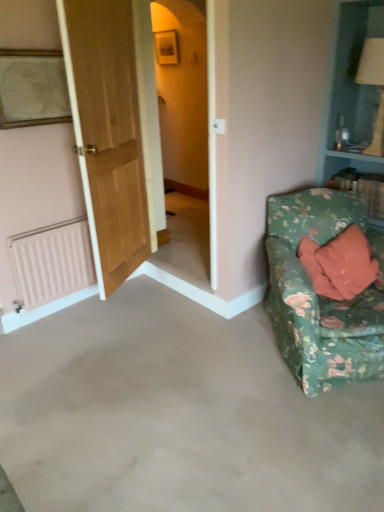
The image size is (384, 512). What do you see at coordinates (51, 262) in the screenshot?
I see `pink matte radiator at lower left` at bounding box center [51, 262].

The height and width of the screenshot is (512, 384). I want to click on wooden door at left, so click(x=107, y=133).

From the image's perspective, which one is positioned lower, gray carpet at lower right or floral fabric couch at lower right?

From the image's view, gray carpet at lower right is below.

Could you tell me if gray carpet at lower right is turned towards floral fabric couch at lower right?

Yes, gray carpet at lower right is oriented towards floral fabric couch at lower right.

Locate an element on the screen. studio couch above the gray carpet at lower right (from a real-world perspective) is located at coordinates (322, 296).

Are gray carpet at lower right and floral fabric couch at lower right far apart?

Actually, gray carpet at lower right and floral fabric couch at lower right are a little close together.

How far apart are gray carpet at lower right and wooden framed portrait at upper left?

They are 5.68 feet apart.

Is gray carpet at lower right bigger or smaller than wooden framed portrait at upper left?

Clearly, gray carpet at lower right is larger in size than wooden framed portrait at upper left.

Does gray carpet at lower right have a lesser height compared to wooden framed portrait at upper left?

Yes.

Considering the relative positions of gray carpet at lower right and wooden framed portrait at upper left in the image provided, is gray carpet at lower right to the right of wooden framed portrait at upper left from the viewer's perspective?

Correct, you'll find gray carpet at lower right to the right of wooden framed portrait at upper left.

Is floral fabric couch at lower right positioned with its back to wooden door at left?

That's not correct — floral fabric couch at lower right is not looking away from wooden door at left.

Does floral fabric couch at lower right have a lesser width compared to wooden door at left?

In fact, floral fabric couch at lower right might be wider than wooden door at left.

Can you confirm if floral fabric couch at lower right is bigger than wooden door at left?

Yes.

Considering the relative sizes of floral fabric couch at lower right and pink matte radiator at lower left in the image provided, is floral fabric couch at lower right shorter than pink matte radiator at lower left?

In fact, floral fabric couch at lower right may be taller than pink matte radiator at lower left.

Is floral fabric couch at lower right inside or outside of pink matte radiator at lower left?

The correct answer is: outside.

Considering the relative sizes of floral fabric couch at lower right and pink matte radiator at lower left in the image provided, is floral fabric couch at lower right smaller than pink matte radiator at lower left?

No, floral fabric couch at lower right is not smaller than pink matte radiator at lower left.

Considering the points (286, 349) and (14, 268), which point is in front, point (286, 349) or point (14, 268)?

Point (286, 349)

Considering the relative sizes of white fabric table lamp at upper right and wooden framed portrait at upper left in the image provided, is white fabric table lamp at upper right taller than wooden framed portrait at upper left?

Indeed, white fabric table lamp at upper right has a greater height compared to wooden framed portrait at upper left.

Locate an element on the screen. This screenshot has height=512, width=384. table lamp on the right of the wooden framed portrait at upper left is located at coordinates (374, 85).

From a real-world perspective, is white fabric table lamp at upper right physically located above or below wooden framed portrait at upper left?

In terms of real-world spatial position, white fabric table lamp at upper right is below wooden framed portrait at upper left.

Are white fabric table lamp at upper right and wooden framed portrait at upper left making contact?

No.

Is floral fabric couch at lower right wider or thinner than gray carpet at lower right?

Considering their sizes, floral fabric couch at lower right looks slimmer than gray carpet at lower right.

Is gray carpet at lower right located within floral fabric couch at lower right?

No, gray carpet at lower right is not a part of floral fabric couch at lower right.

Is floral fabric couch at lower right oriented towards gray carpet at lower right?

No.

Between floral fabric couch at lower right and gray carpet at lower right, which one appears on the right side from the viewer's perspective?

Positioned to the right is floral fabric couch at lower right.

Is point (61, 90) more distant than point (366, 84)?

No, it is not.

Is white fabric table lamp at upper right inside wooden framed portrait at upper left?

No, white fabric table lamp at upper right is not a part of wooden framed portrait at upper left.

Does wooden framed portrait at upper left have a smaller size compared to white fabric table lamp at upper right?

Yes.

Is wooden framed portrait at upper left aimed at white fabric table lamp at upper right?

No, wooden framed portrait at upper left is not oriented towards white fabric table lamp at upper right.

Identify the location of studio couch behind the gray carpet at lower right. [322, 296].

In order to click on concrete in front of the wooden framed portrait at upper left in this screenshot , I will do `click(177, 414)`.

Looking at the image, which one is located further to white fabric table lamp at upper right, floral fabric couch at lower right or wooden framed portrait at upper left?

wooden framed portrait at upper left is further to white fabric table lamp at upper right.

Estimate the real-world distances between objects in this image. Which object is further from floral fabric couch at lower right, white fabric table lamp at upper right or wooden framed portrait at upper left?

wooden framed portrait at upper left.

From the image, which object appears to be nearer to white fabric table lamp at upper right, pink matte radiator at lower left or gray carpet at lower right?

gray carpet at lower right.

Estimate the real-world distances between objects in this image. Which object is closer to gray carpet at lower right, floral fabric couch at lower right or wooden door at left?

floral fabric couch at lower right is positioned closer to the anchor gray carpet at lower right.

From the image, which object appears to be farther from gray carpet at lower right, wooden framed portrait at upper left or white fabric table lamp at upper right?

white fabric table lamp at upper right is further to gray carpet at lower right.

Estimate the real-world distances between objects in this image. Which object is further from floral fabric couch at lower right, white fabric table lamp at upper right or pink matte radiator at lower left?

pink matte radiator at lower left.

Based on their spatial positions, is floral fabric couch at lower right or wooden door at left closer to wooden framed portrait at upper left?

The object closer to wooden framed portrait at upper left is wooden door at left.

From the image, which object appears to be farther from pink matte radiator at lower left, floral fabric couch at lower right or wooden door at left?

Among the two, floral fabric couch at lower right is located further to pink matte radiator at lower left.

Identify the location of concrete between pink matte radiator at lower left and white fabric table lamp at upper right. (177, 414).

Identify the location of door positioned between gray carpet at lower right and pink matte radiator at lower left from near to far. (107, 133).

The width and height of the screenshot is (384, 512). I want to click on concrete between pink matte radiator at lower left and floral fabric couch at lower right, so click(x=177, y=414).

Locate an element on the screen. The height and width of the screenshot is (512, 384). studio couch situated between pink matte radiator at lower left and white fabric table lamp at upper right from left to right is located at coordinates (322, 296).